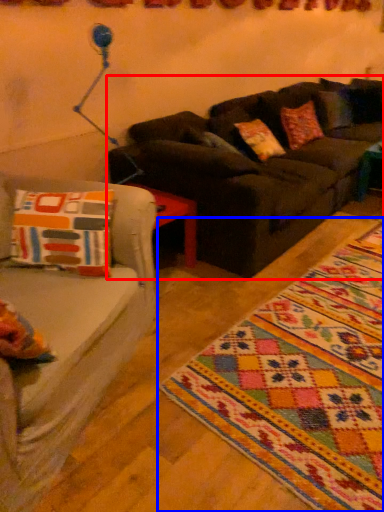
Question: Which point is further to the camera, studio couch (highlighted by a red box) or mat (highlighted by a blue box)?

Choices:
 (A) studio couch
 (B) mat

Answer: (A)